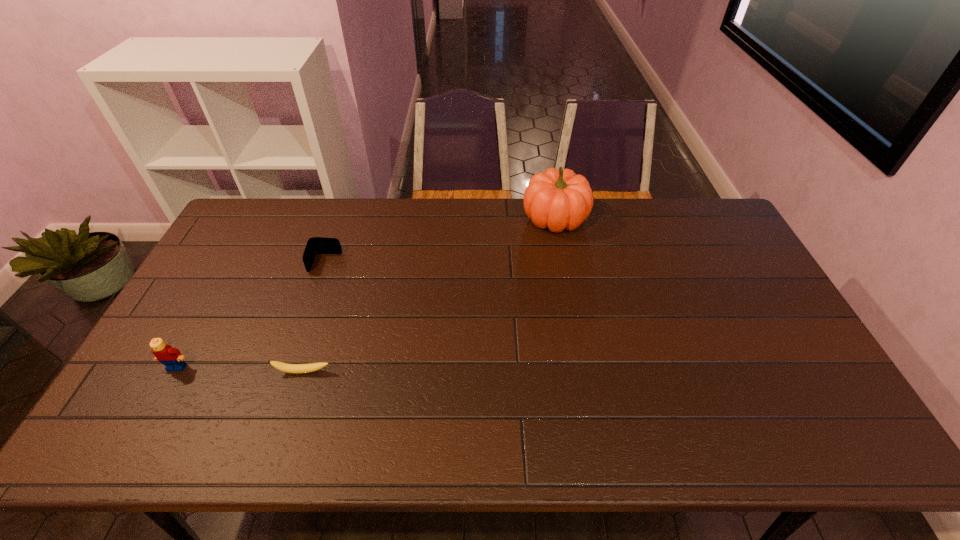
What are the coordinates of `free point between the banana and the third shortest object` in the screenshot? It's located at (240, 369).

This screenshot has width=960, height=540. What are the coordinates of `vacant space that is in between the wallet and the second tallest object` in the screenshot? It's located at (252, 315).

Where is `vacant area between the farthest object and the leftmost object`? The height and width of the screenshot is (540, 960). vacant area between the farthest object and the leftmost object is located at coordinates (366, 293).

You are a GUI agent. You are given a task and a screenshot of the screen. Output one action in this format:
    pyautogui.click(x=<x>, y=<y>)
    Task: Click on the free space between the tallest object and the second farthest object
    
    Given the screenshot: What is the action you would take?
    pyautogui.click(x=440, y=241)

Locate an element on the screen. This screenshot has width=960, height=540. vacant space in between the leftmost object and the second shortest object is located at coordinates (252, 315).

The height and width of the screenshot is (540, 960). Find the location of `free area in between the banana and the third nearest object`. free area in between the banana and the third nearest object is located at coordinates [314, 318].

Locate an element on the screen. This screenshot has width=960, height=540. free space between the third tallest object and the leftmost object is located at coordinates [x=252, y=315].

Locate an element on the screen. The height and width of the screenshot is (540, 960). the second closest object to the pumpkin is located at coordinates (312, 367).

Locate an element on the screen. This screenshot has width=960, height=540. the third closest object relative to the Lego is located at coordinates coord(559,200).